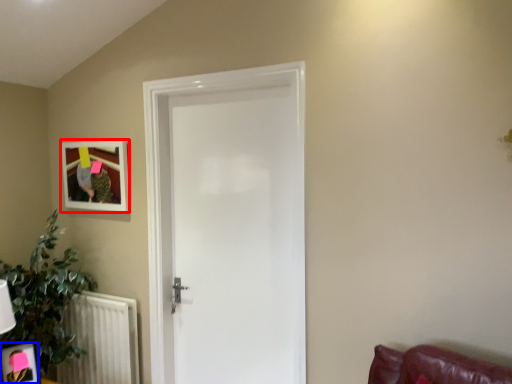
Question: Which object appears closest to the camera in this image, picture frame (highlighted by a red box) or picture frame (highlighted by a blue box)?

Choices:
 (A) picture frame
 (B) picture frame

Answer: (B)